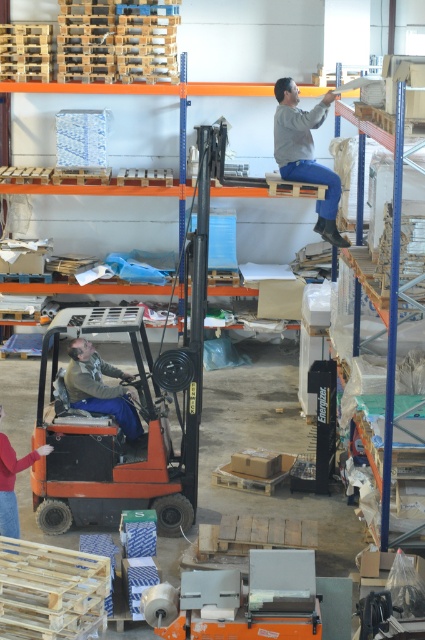
Consider the image. You are a warehouse worker who needs to locate the person wearing the red sweater at lower left. From your vantage point, where would you look relative to the blue denim pants at lower left?

The blue denim pants at lower left is located above the red sweater at lower left, so you should look below the blue denim pants at lower left to find the red sweater at lower left.

You are a warehouse worker needing to move a large box that requires a forklift. You see the orange matte forklift at center and the gray fabric pants at upper center. Which object can you use to move the box?

The orange matte forklift at center can be used to move the box since it is larger in width than the gray fabric pants at upper center, making it suitable for handling large items.

You are a warehouse worker standing at the entrance and see two people in the scene, the blue denim pants at lower left and the red sweater at lower left. Which person is closer to you?

The blue denim pants at lower left is closer to you because it is further to the viewer than the red sweater at lower left, meaning it appears nearer in the image.